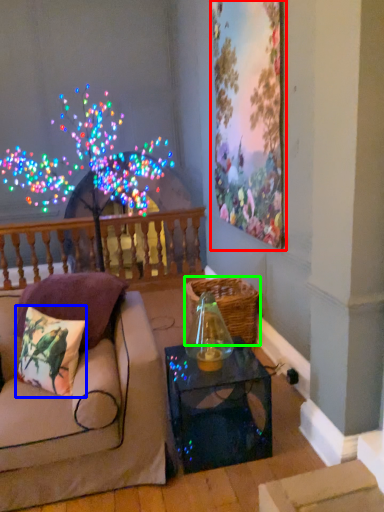
Question: Which object is positioned farthest from picture frame (highlighted by a red box)? Select from pillow (highlighted by a blue box) and basket (highlighted by a green box).

Choices:
 (A) pillow
 (B) basket

Answer: (A)